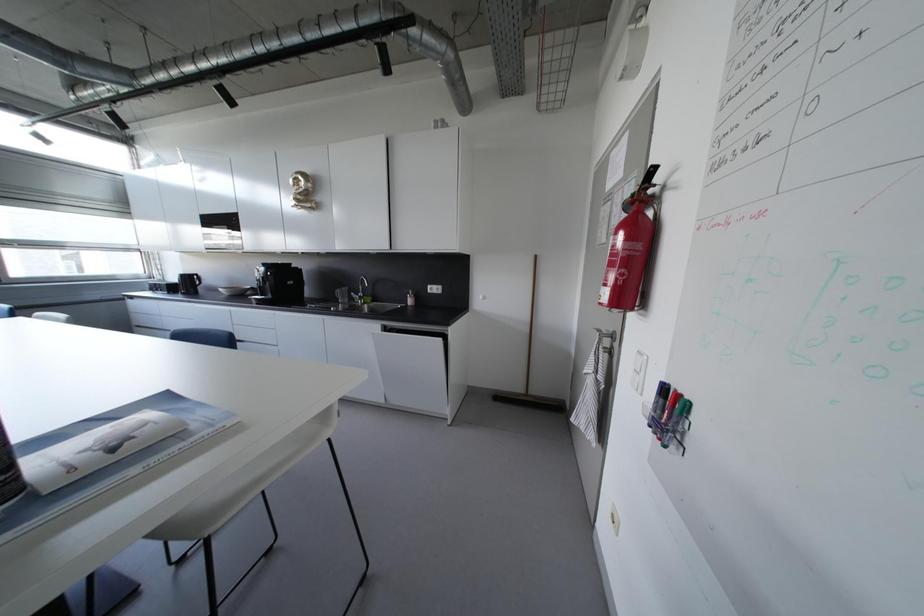
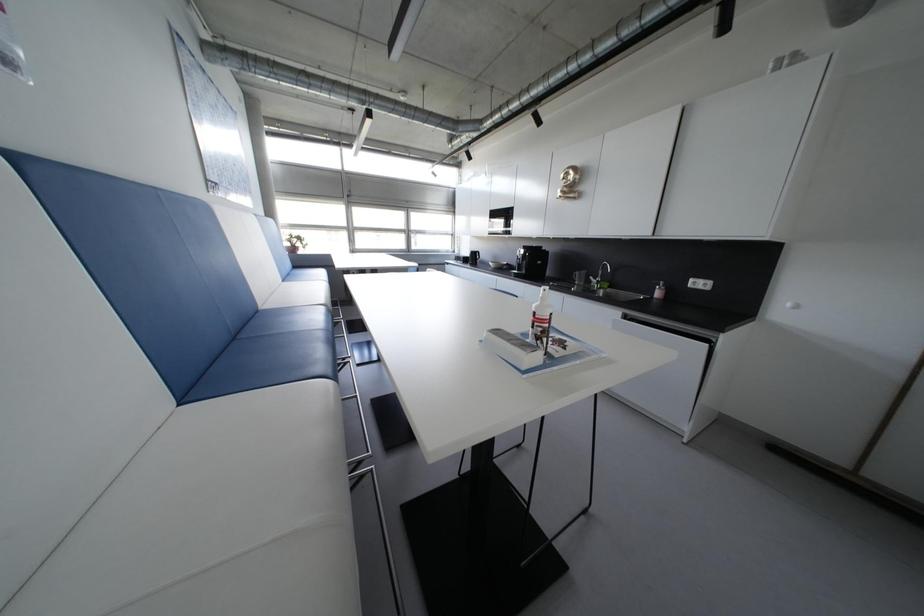
Question: The camera is either moving clockwise (left) or counter-clockwise (right) around the object. The first image is from the beginning of the video and the second image is from the end. Is the camera moving left or right when shooting the video?

Choices:
 (A) Left
 (B) Right

Answer: (B)